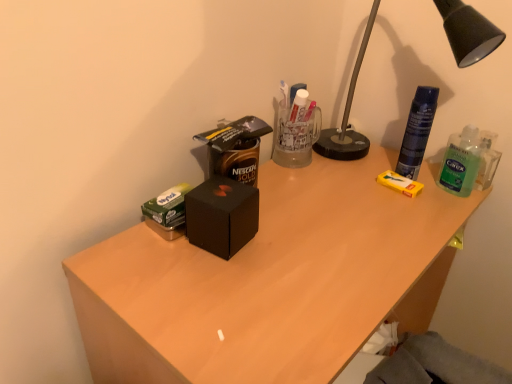
This screenshot has width=512, height=384. What do you see at coordinates (271, 281) in the screenshot?
I see `matte black box at center` at bounding box center [271, 281].

What do you see at coordinates (468, 32) in the screenshot?
I see `black metal lamp at upper right` at bounding box center [468, 32].

Find the location of `matte black box at center`. matte black box at center is located at coordinates (271, 281).

Is black metal lamp at upper right oriented towards green translucent hand sanitizer at right?

Yes.

Which of these two, black metal lamp at upper right or green translucent hand sanitizer at right, stands taller?

Standing taller between the two is black metal lamp at upper right.

Is black metal lamp at upper right not close to green translucent hand sanitizer at right?

No, black metal lamp at upper right is not far from green translucent hand sanitizer at right.

How much distance is there between black metal lamp at upper right and green translucent hand sanitizer at right?

black metal lamp at upper right is 7.55 inches from green translucent hand sanitizer at right.

Can you confirm if black matte box at center is taller than black metal lamp at upper right?

In fact, black matte box at center may be shorter than black metal lamp at upper right.

Is black matte box at center at the left side of black metal lamp at upper right?

Yes.

From a real-world perspective, who is located higher, black matte box at center or black metal lamp at upper right?

black metal lamp at upper right.

Is black matte box at center facing away from black metal lamp at upper right?

That's not correct — black matte box at center is not looking away from black metal lamp at upper right.

Which object is positioned more to the left, matte black box at center or green translucent hand sanitizer at right?

Positioned to the left is matte black box at center.

Which of these two, matte black box at center or green translucent hand sanitizer at right, stands shorter?

green translucent hand sanitizer at right is shorter.

From the image's perspective, would you say matte black box at center is shown under green translucent hand sanitizer at right?

Yes, from the image's perspective, matte black box at center is below green translucent hand sanitizer at right.

In the image, is matte black box at center positioned in front of or behind green translucent hand sanitizer at right?

Clearly, matte black box at center is in front of green translucent hand sanitizer at right.

Could you tell me if black matte box at center is facing green translucent hand sanitizer at right?

No, black matte box at center is not oriented towards green translucent hand sanitizer at right.

Who is smaller, black matte box at center or green translucent hand sanitizer at right?

With smaller size is green translucent hand sanitizer at right.

Which is less distant, [237,225] or [443,188]?

Positioned in front is point [237,225].

From the image's perspective, is black matte box at center below green translucent hand sanitizer at right?

Yes.

Consider the image. Is green translucent hand sanitizer at right smaller than matte black box at center?

Correct, green translucent hand sanitizer at right occupies less space than matte black box at center.

Does green translucent hand sanitizer at right have a greater width compared to matte black box at center?

In fact, green translucent hand sanitizer at right might be narrower than matte black box at center.

Is green translucent hand sanitizer at right positioned far away from matte black box at center?

No, green translucent hand sanitizer at right is in close proximity to matte black box at center.

Is green translucent hand sanitizer at right outside of matte black box at center?

Absolutely, green translucent hand sanitizer at right is external to matte black box at center.

Measure the distance from green translucent hand sanitizer at right to black matte box at center.

A distance of 19.08 inches exists between green translucent hand sanitizer at right and black matte box at center.

Consider the image. Is green translucent hand sanitizer at right looking in the opposite direction of black matte box at center?

No, green translucent hand sanitizer at right's orientation is not away from black matte box at center.

Looking at this image, which object is more forward, green translucent hand sanitizer at right or black matte box at center?

Positioned in front is black matte box at center.

Based on the photo, from a real-world perspective, is green translucent hand sanitizer at right beneath black matte box at center?

No, from a real-world perspective, green translucent hand sanitizer at right is not beneath black matte box at center.

Considering the sizes of objects matte black box at center and black metal lamp at upper right in the image provided, who is shorter, matte black box at center or black metal lamp at upper right?

Standing shorter between the two is black metal lamp at upper right.

Is matte black box at center to the left or to the right of black metal lamp at upper right in the image?

Clearly, matte black box at center is on the left of black metal lamp at upper right in the image.

Relative to black metal lamp at upper right, is matte black box at center in front or behind?

Clearly, matte black box at center is in front of black metal lamp at upper right.

Identify the location of desk below the black metal lamp at upper right (from a real-world perspective). Image resolution: width=512 pixels, height=384 pixels. (271, 281).

You are a GUI agent. You are given a task and a screenshot of the screen. Output one action in this format:
    pyautogui.click(x=<x>, y=<y>)
    Task: Click on the lamp above the green translucent hand sanitizer at right (from a real-world perspective)
    Image resolution: width=512 pixels, height=384 pixels.
    Given the screenshot: What is the action you would take?
    (x=468, y=32)

Where is `box directly beneath the black metal lamp at upper right (from a real-world perspective)`? This screenshot has width=512, height=384. box directly beneath the black metal lamp at upper right (from a real-world perspective) is located at coordinates (221, 215).

Looking at the image, which one is located closer to green translucent hand sanitizer at right, black metal lamp at upper right or black matte box at center?

Among the two, black metal lamp at upper right is located nearer to green translucent hand sanitizer at right.

Looking at the image, which one is located further to black matte box at center, black metal lamp at upper right or matte black box at center?

black metal lamp at upper right is further to black matte box at center.

Looking at the image, which one is located further to green translucent hand sanitizer at right, black metal lamp at upper right or matte black box at center?

matte black box at center is further to green translucent hand sanitizer at right.

From the image, which object appears to be farther from black matte box at center, matte black box at center or green translucent hand sanitizer at right?

green translucent hand sanitizer at right.

When comparing their distances from matte black box at center, does black matte box at center or black metal lamp at upper right seem closer?

Based on the image, black matte box at center appears to be nearer to matte black box at center.

Looking at the image, which one is located closer to black metal lamp at upper right, green translucent hand sanitizer at right or black matte box at center?

green translucent hand sanitizer at right.

Considering their positions, is black matte box at center positioned further to green translucent hand sanitizer at right than black metal lamp at upper right?

black matte box at center is further to green translucent hand sanitizer at right.

Looking at the image, which one is located closer to green translucent hand sanitizer at right, matte black box at center or black metal lamp at upper right?

black metal lamp at upper right.

Locate an element on the screen. This screenshot has width=512, height=384. lamp located between black matte box at center and green translucent hand sanitizer at right in the left-right direction is located at coordinates (468, 32).

Identify the location of bottle between black metal lamp at upper right and matte black box at center vertically. (461, 162).

Locate an element on the screen. desk situated between black matte box at center and green translucent hand sanitizer at right from left to right is located at coordinates (271, 281).

I want to click on box between black metal lamp at upper right and matte black box at center in the up-down direction, so click(x=221, y=215).